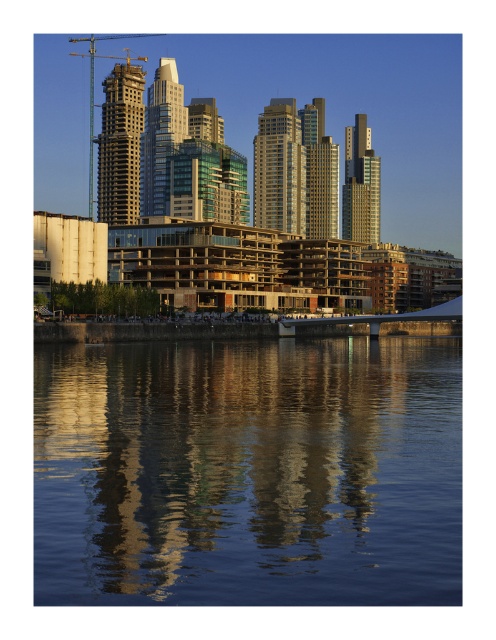
Question: Does gold glass tower at center have a smaller size compared to glassy steel skyscraper at center?

Choices:
 (A) no
 (B) yes

Answer: (B)

Question: Is gold glass skyscraper at center bigger than glassy steel skyscraper at center?

Choices:
 (A) yes
 (B) no

Answer: (A)

Question: Which of the following is the farthest from the observer?

Choices:
 (A) (121, 209)
 (B) (176, 113)
 (C) (430, 394)
 (D) (349, 156)

Answer: (D)

Question: Is transparent glass water at center wider than gold glass tower at center?

Choices:
 (A) no
 (B) yes

Answer: (B)

Question: Which object is closer to the camera taking this photo?

Choices:
 (A) transparent glass water at center
 (B) glossy glass building at center
 (C) glassy steel skyscraper at center
 (D) glassy concrete skyscraper at upper left

Answer: (A)

Question: Which object is closer to the camera taking this photo?

Choices:
 (A) glassy concrete skyscraper at upper left
 (B) gold glass tower at center
 (C) transparent glass water at center

Answer: (C)